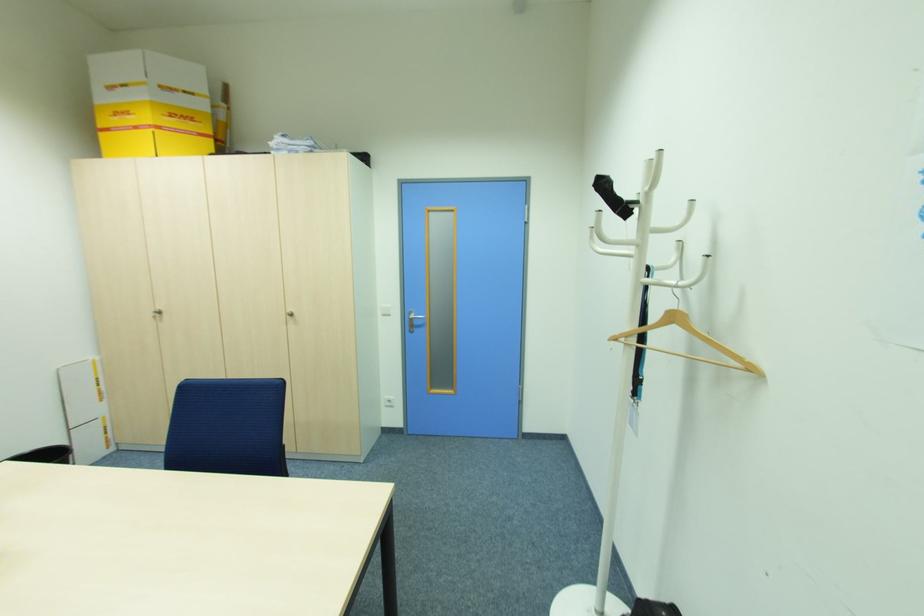
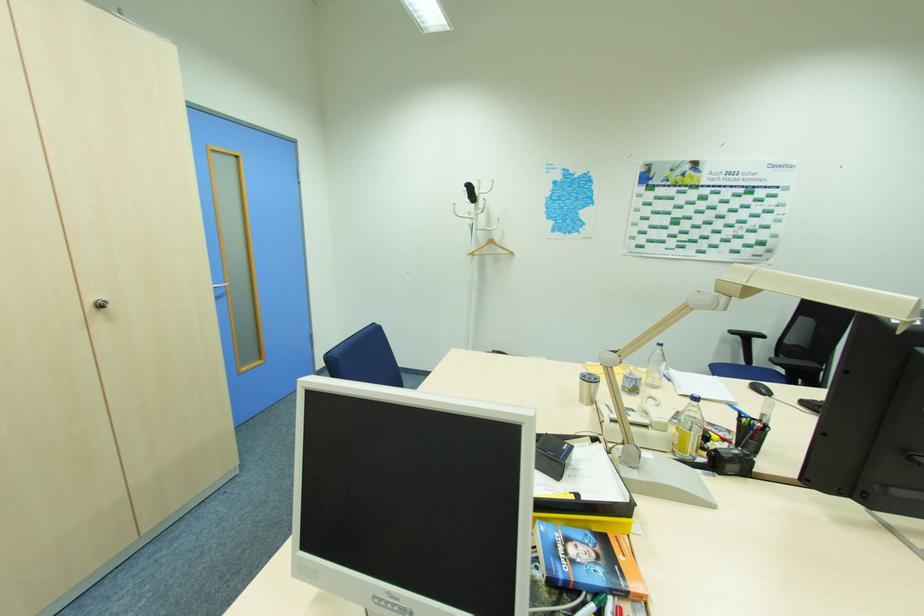
The point at (676,282) is marked in the first image. Where is the corresponding point in the second image?

(492, 229)